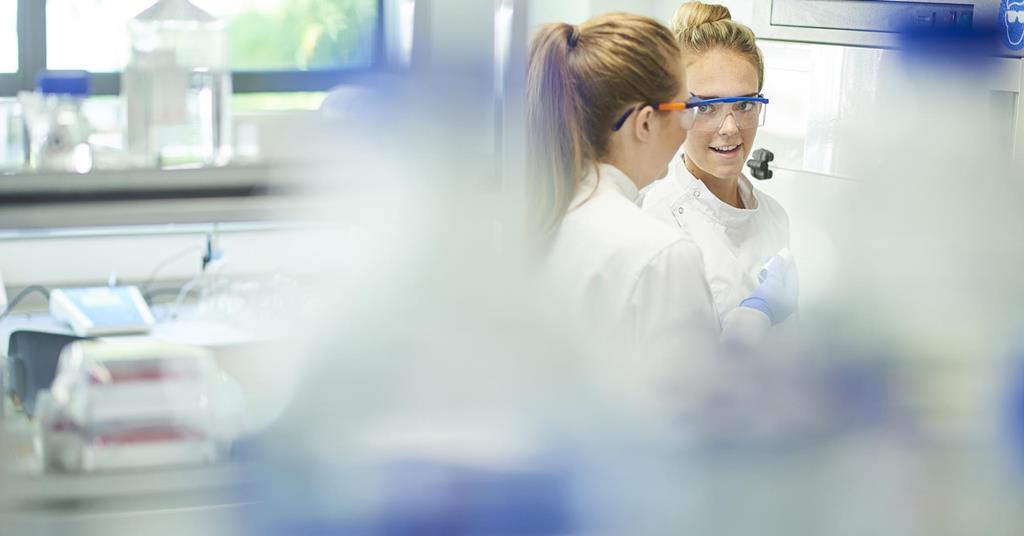
At what (x,y) coordinates should I click in order to perform the action: click on glass. Please return your answer as a coordinate pair (x, y). The image size is (1024, 536). Looking at the image, I should click on (183, 96).